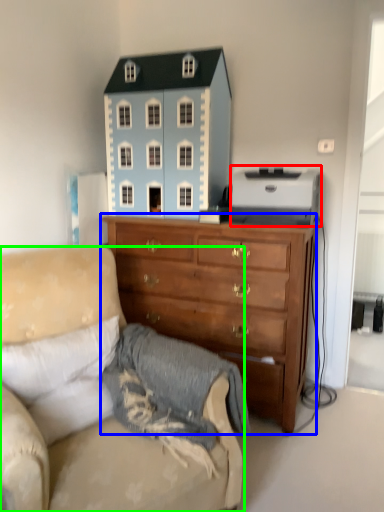
Question: Based on their relative distances, which object is farther from toy (highlighted by a red box)? Choose from chest of drawers (highlighted by a blue box) and studio couch (highlighted by a green box).

Choices:
 (A) chest of drawers
 (B) studio couch

Answer: (B)